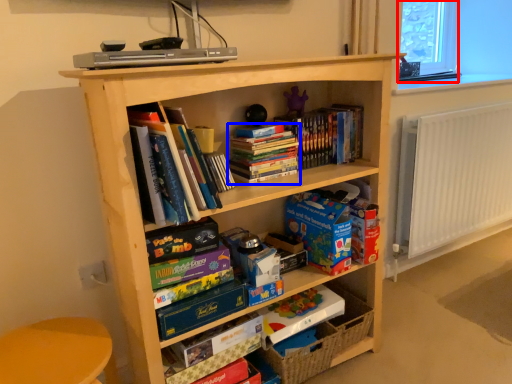
Question: Among these objects, which one is farthest to the camera, window screen (highlighted by a red box) or book (highlighted by a blue box)?

Choices:
 (A) window screen
 (B) book

Answer: (A)